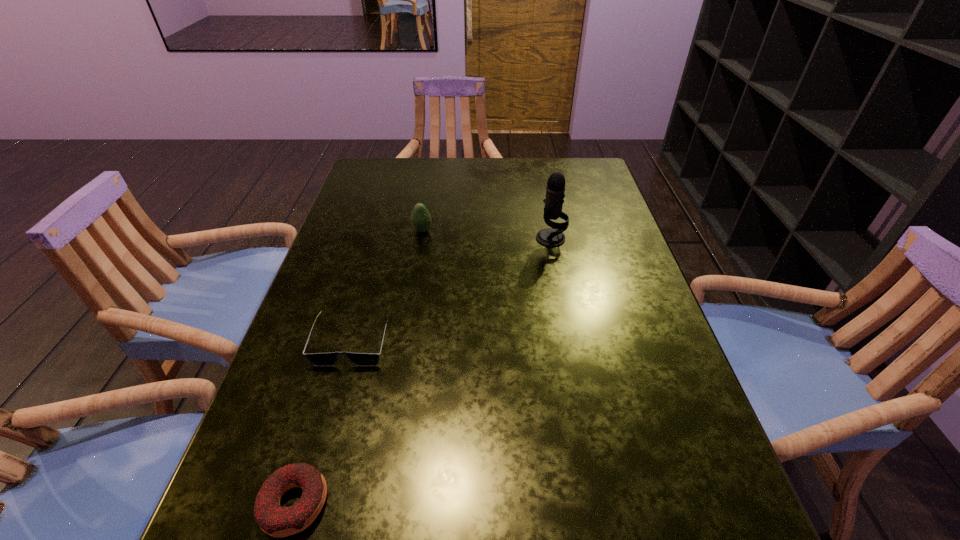
This screenshot has height=540, width=960. Find the location of `free spot at the left edge of the desktop`. free spot at the left edge of the desktop is located at coordinates (294, 408).

Locate an element on the screen. The height and width of the screenshot is (540, 960). free point at the right edge is located at coordinates (603, 388).

Identify the location of vacant space at the far left corner of the desktop. The height and width of the screenshot is (540, 960). (400, 182).

Identify the location of vacant space at the far right corner of the desktop. (582, 183).

This screenshot has width=960, height=540. Find the location of `unoccupied position between the microphone and the second nearest object`. unoccupied position between the microphone and the second nearest object is located at coordinates pyautogui.click(x=451, y=289).

What are the coordinates of `free spot between the sunglasses and the rightmost object` in the screenshot? It's located at (451, 289).

Identify the location of vacant space that is in between the avocado and the third farthest object. The image size is (960, 540). (387, 286).

Identify the location of free point between the rightmost object and the sunglasses. The width and height of the screenshot is (960, 540). (451, 289).

I want to click on free spot between the sunglasses and the avocado, so click(x=387, y=286).

Image resolution: width=960 pixels, height=540 pixels. Find the location of `unoccupied position between the third farthest object and the rightmost object`. unoccupied position between the third farthest object and the rightmost object is located at coordinates (451, 289).